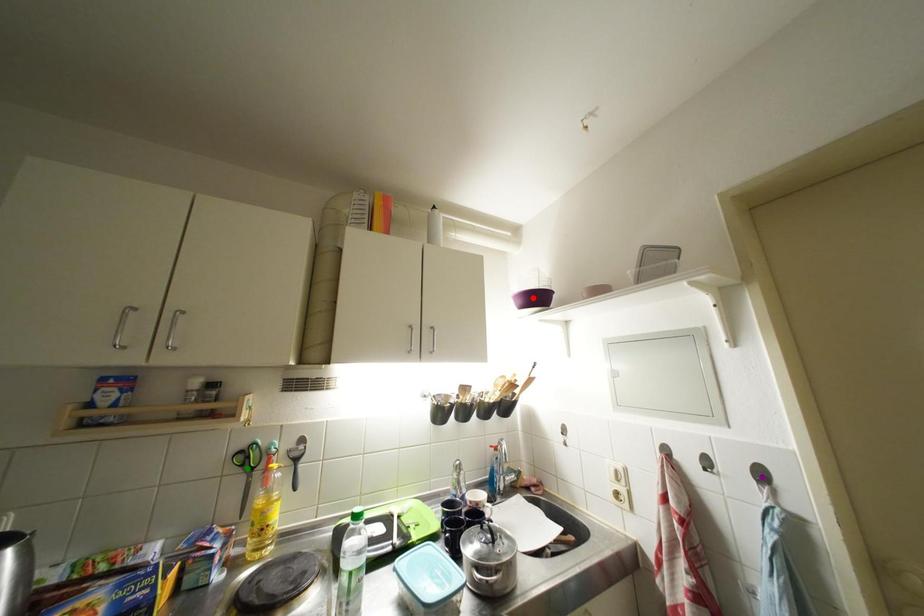
Order these from nearest to farthest:
1. red point
2. green point
3. purple point

red point, green point, purple point